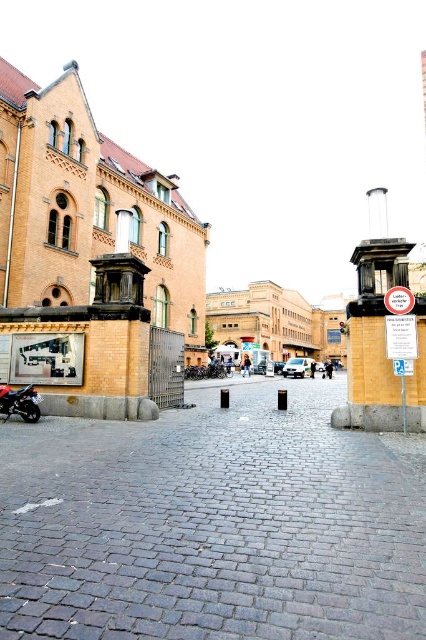
You are standing at the point marked by the coordinates point (213, 522), which is on the gray cobblestone pavement at center. Looking towards the large historic building with the red roof, which direction should you walk to reach the ornate gate made of dark metal at the entrance?

The gray cobblestone pavement at center is located at point (213, 522). Since the cobblestone street leads towards the building, you should walk forward along the gray cobblestone pavement at center towards the building to reach the ornate gate made of dark metal at the entrance.